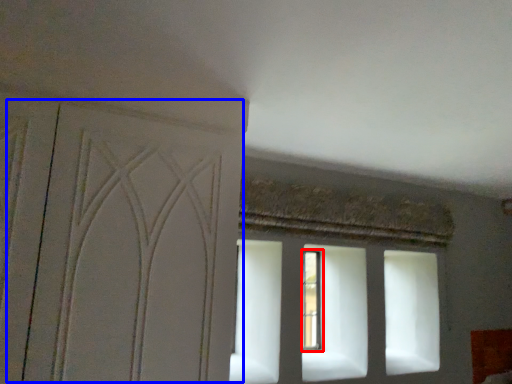
Question: Which point is further to the camera, window (highlighted by a red box) or screen door (highlighted by a blue box)?

Choices:
 (A) window
 (B) screen door

Answer: (A)